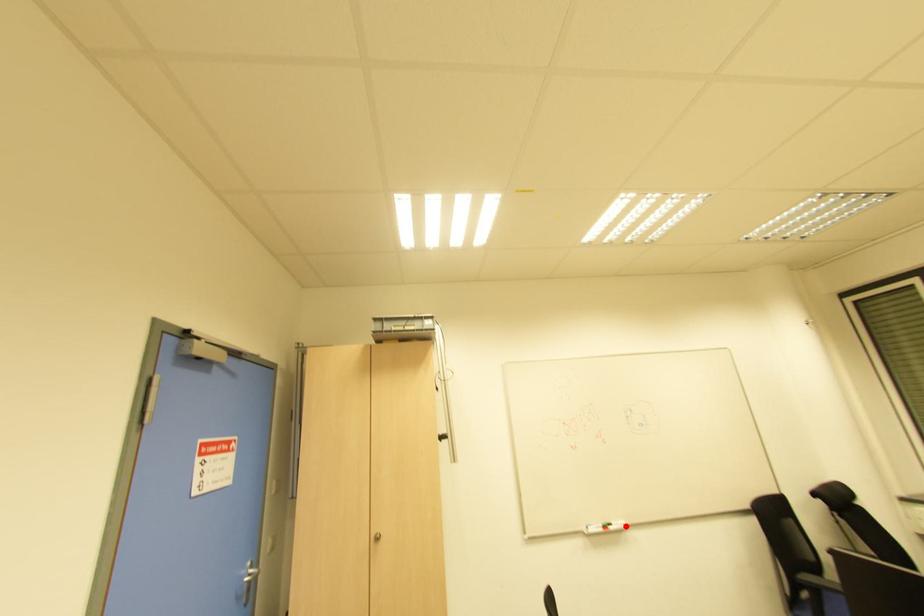
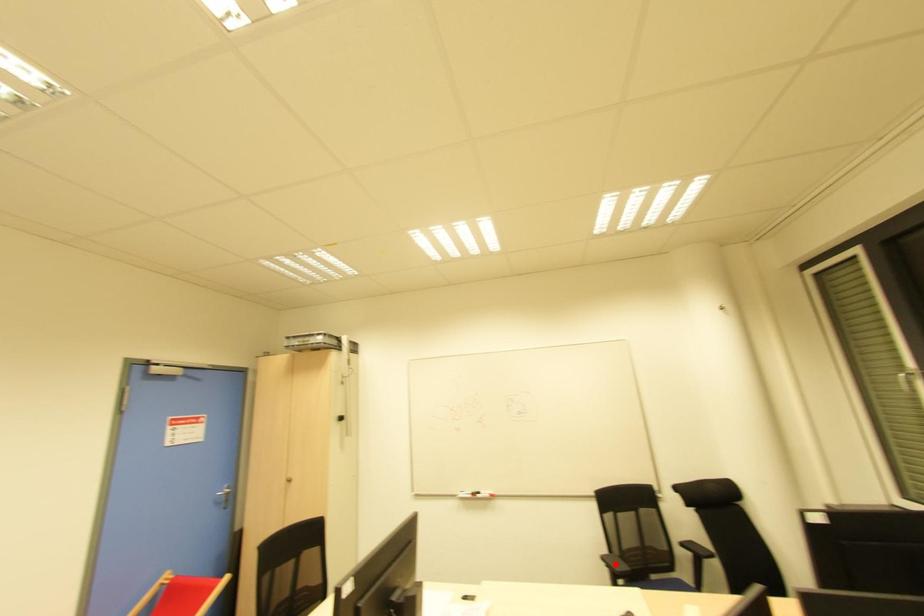
Consider the image. I am providing you with two images of the same scene from different viewpoints. A red point is marked on the first image and another point is marked on the second image. Is the marked point in image1 the same physical position as the marked point in image2?

No